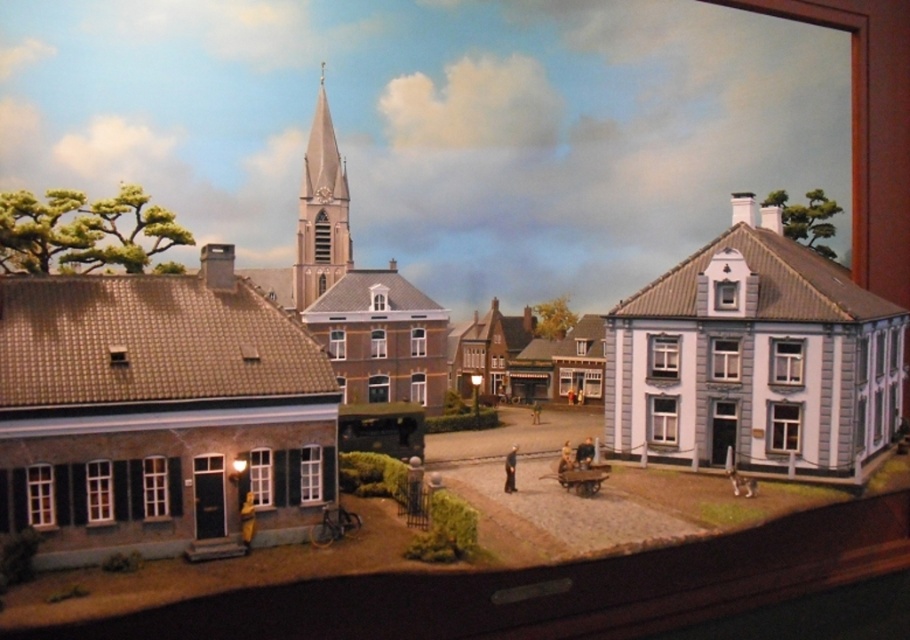
Question: Which point is closer to the camera?

Choices:
 (A) brown textured brick church at left
 (B) white painted wood house at center right

Answer: (A)

Question: In this image, where is white painted wood house at center right located relative to light beige stone spire at center?

Choices:
 (A) below
 (B) above

Answer: (A)

Question: Which of the following is the closest to the observer?

Choices:
 (A) light beige stone spire at center
 (B) brown textured brick church at left
 (C) wooden cart at center

Answer: (B)

Question: Is the position of white painted wood house at center right less distant than that of smooth beige steeple at center?

Choices:
 (A) yes
 (B) no

Answer: (B)

Question: Does brown textured brick church at left appear over smooth beige steeple at center?

Choices:
 (A) yes
 (B) no

Answer: (B)

Question: Which is farther from the brown textured brick church at left?

Choices:
 (A) wooden cart at center
 (B) light beige stone spire at center
 (C) white painted wood house at center right
 (D) smooth beige steeple at center

Answer: (B)